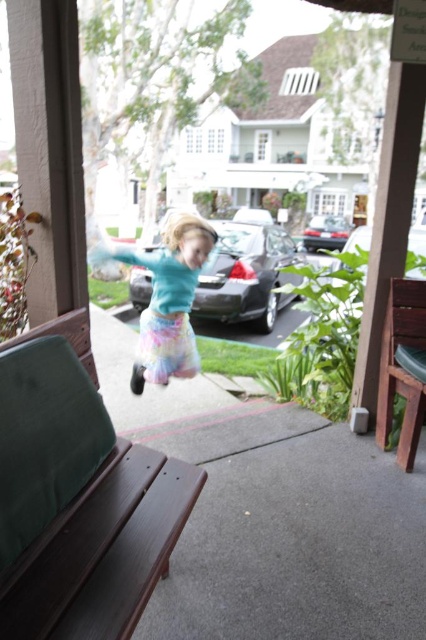
Question: Can you confirm if pastel tie-dye skirt at center is positioned below pastel cotton ballet skirt at center?

Choices:
 (A) no
 (B) yes

Answer: (A)

Question: Which point is farther from the camera taking this photo?

Choices:
 (A) (146, 305)
 (B) (163, 358)
 (C) (176, 305)
 (D) (129, 496)

Answer: (A)

Question: Which object is farther from the camera taking this photo?

Choices:
 (A) pastel tie-dye skirt at center
 (B) wooden park bench at right
 (C) shiny black car at center

Answer: (C)

Question: Can you confirm if wooden park bench at right is positioned to the right of pastel cotton ballet skirt at center?

Choices:
 (A) no
 (B) yes

Answer: (B)

Question: Which object is the farthest from the glossy black car at center?

Choices:
 (A) pastel tie-dye skirt at center
 (B) wooden park bench at lower left
 (C) pastel cotton ballet skirt at center
 (D) wooden park bench at right

Answer: (B)

Question: Is wooden park bench at lower left in front of glossy black car at center?

Choices:
 (A) no
 (B) yes

Answer: (B)